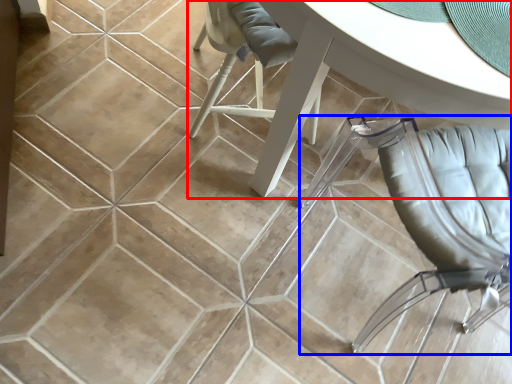
Question: Which point is further to the camera, table (highlighted by a red box) or chair (highlighted by a blue box)?

Choices:
 (A) table
 (B) chair

Answer: (A)